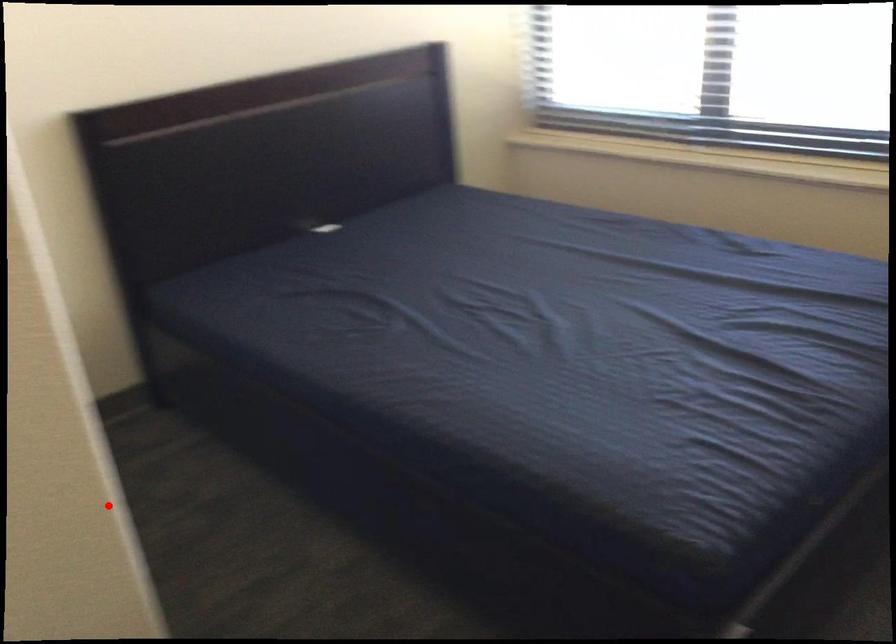
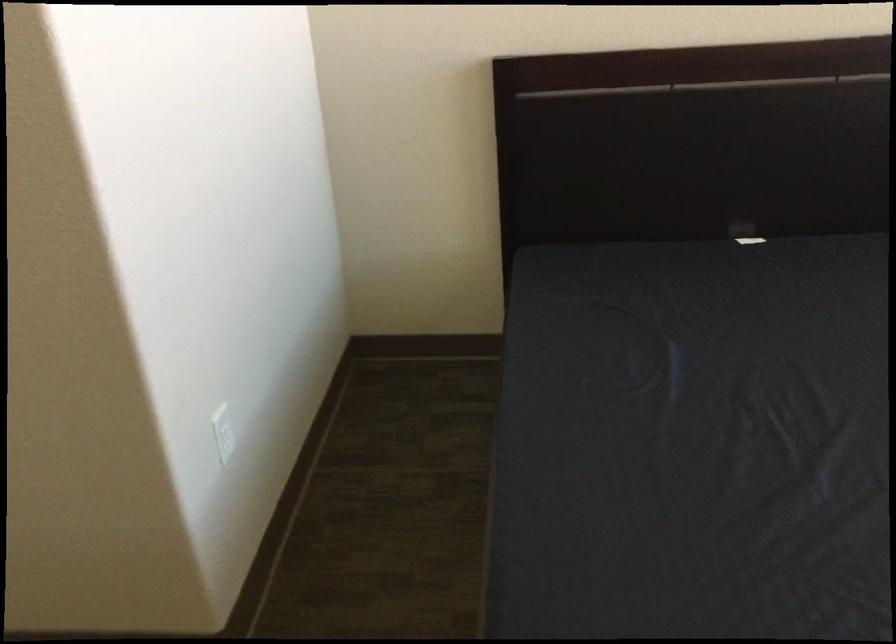
Find the pixel in the second image that matches the highlighted location in the first image.

(222, 431)